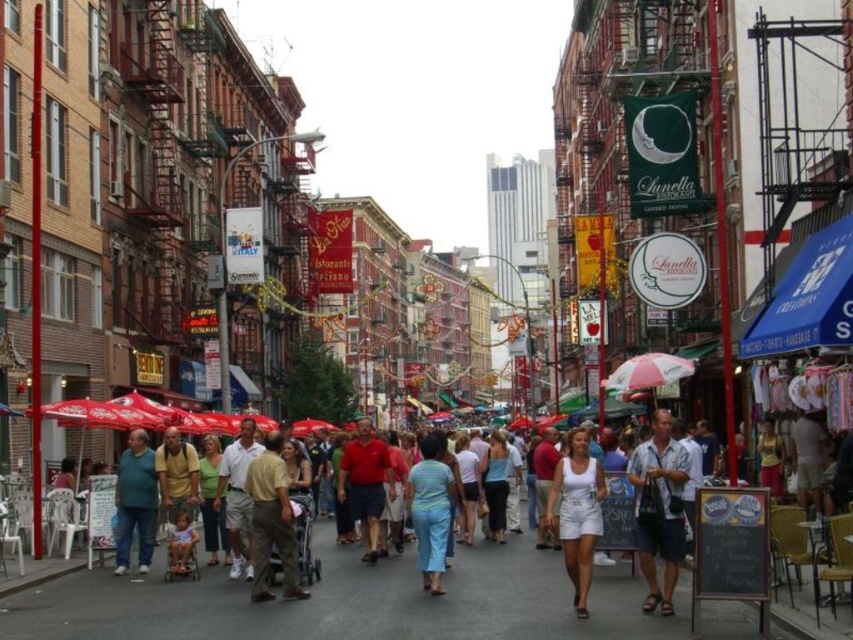
Who is positioned more to the left, white cotton shorts at center or khaki cotton pants at center?

From the viewer's perspective, khaki cotton pants at center appears more on the left side.

Can you confirm if white cotton shorts at center is bigger than khaki cotton pants at center?

Yes, white cotton shorts at center is bigger than khaki cotton pants at center.

Between point (560, 534) and point (288, 540), which one is positioned behind?

The point (288, 540) is behind.

You are a GUI agent. You are given a task and a screenshot of the screen. Output one action in this format:
    pyautogui.click(x=<x>, y=<y>)
    Task: Click on the white cotton shorts at center
    The image size is (853, 640).
    Given the screenshot: What is the action you would take?
    pyautogui.click(x=577, y=513)

Does blue fabric canopy at right have a smaller size compared to matte green shirt at center?

Indeed, blue fabric canopy at right has a smaller size compared to matte green shirt at center.

Does point (850, 298) lie in front of point (120, 566)?

Yes, it is.

This screenshot has height=640, width=853. I want to click on blue fabric canopy at right, so click(808, 298).

Does light blue denim shorts at center come in front of khaki cotton pants at center?

That is True.

Is point (648, 458) behind point (271, 477)?

No, (648, 458) is in front of (271, 477).

The width and height of the screenshot is (853, 640). Find the location of `light blue denim shorts at center`. light blue denim shorts at center is located at coordinates (659, 508).